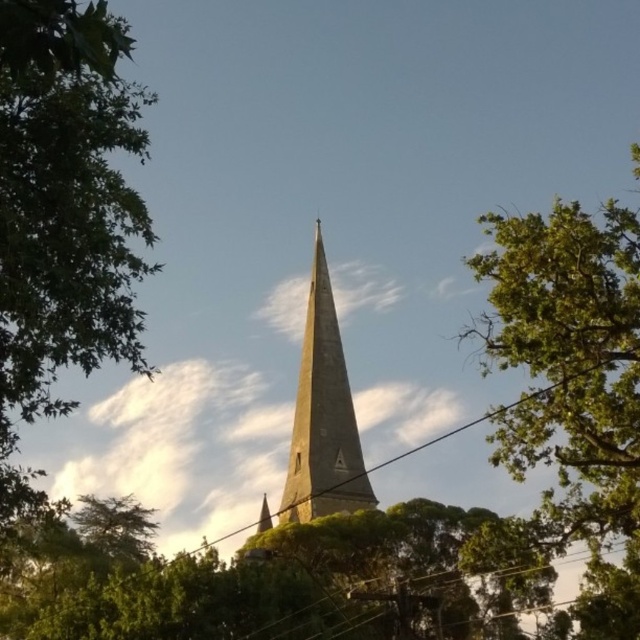
Is green leafy tree at left above green leafy tree at upper right?

Yes, green leafy tree at left is above green leafy tree at upper right.

Does green leafy tree at left have a lesser width compared to green leafy tree at upper right?

No.

Locate an element on the screen. The image size is (640, 640). green leafy tree at left is located at coordinates (64, 211).

Can you confirm if green leafy tree at left is thinner than smooth stone spire at center?

Incorrect, green leafy tree at left's width is not less than smooth stone spire at center's.

This screenshot has width=640, height=640. What are the coordinates of `green leafy tree at left` in the screenshot? It's located at pos(64,211).

The image size is (640, 640). What do you see at coordinates (64, 211) in the screenshot?
I see `green leafy tree at left` at bounding box center [64, 211].

The width and height of the screenshot is (640, 640). Find the location of `green leafy tree at left`. green leafy tree at left is located at coordinates (64, 211).

Is green leafy tree at upper right to the left of smooth stone spire at center from the viewer's perspective?

Incorrect, green leafy tree at upper right is not on the left side of smooth stone spire at center.

I want to click on green leafy tree at upper right, so click(572, 388).